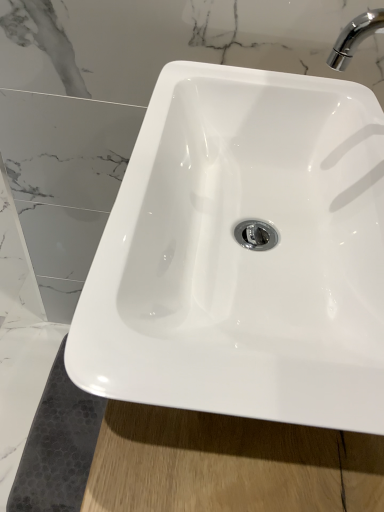
Question: Should I look upward or downward to see white glossy sink at center?

Choices:
 (A) down
 (B) up

Answer: (B)